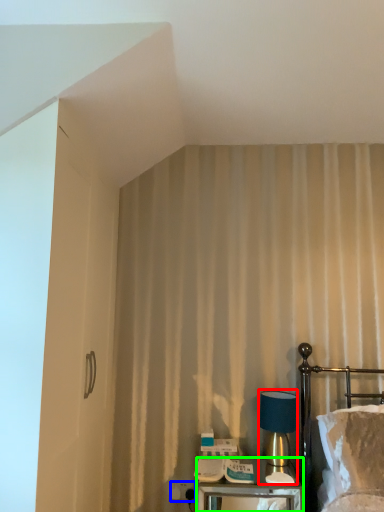
Question: Based on their relative distances, which object is nearer to table lamp (highlighted by a red box)? Choose from electric outlet (highlighted by a blue box) and nightstand (highlighted by a green box).

Choices:
 (A) electric outlet
 (B) nightstand

Answer: (B)